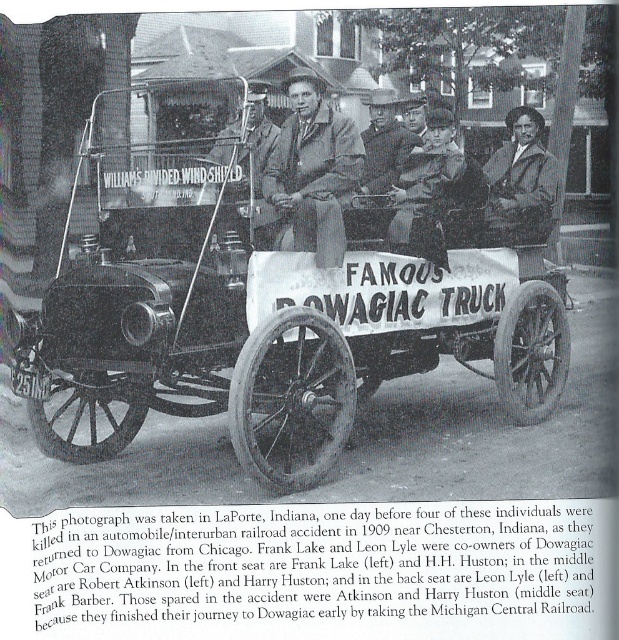
Is metallic polished wagon at center to the right of matte brown coat at center from the viewer's perspective?

No, metallic polished wagon at center is not to the right of matte brown coat at center.

Which is in front, point (373, 218) or point (324, 109)?

Point (373, 218) is in front.

Between point (58, 413) and point (275, 144), which one is positioned in front?

Point (58, 413) is more forward.

The width and height of the screenshot is (619, 640). I want to click on metallic polished wagon at center, so click(x=274, y=284).

Who is taller, matte brown coat at center or dark brown fur coat at center?

Standing taller between the two is matte brown coat at center.

Which is more to the right, matte brown coat at center or dark brown fur coat at center?

Positioned to the right is dark brown fur coat at center.

What do you see at coordinates (313, 172) in the screenshot? I see `matte brown coat at center` at bounding box center [313, 172].

The width and height of the screenshot is (619, 640). Find the location of `matte brown coat at center`. matte brown coat at center is located at coordinates (313, 172).

Does dark brown fur coat at center appear on the right side of smooth leather jacket at center?

Correct, you'll find dark brown fur coat at center to the right of smooth leather jacket at center.

Does dark brown fur coat at center have a greater width compared to smooth leather jacket at center?

Yes.

Locate an element on the screen. This screenshot has width=619, height=640. dark brown fur coat at center is located at coordinates (426, 189).